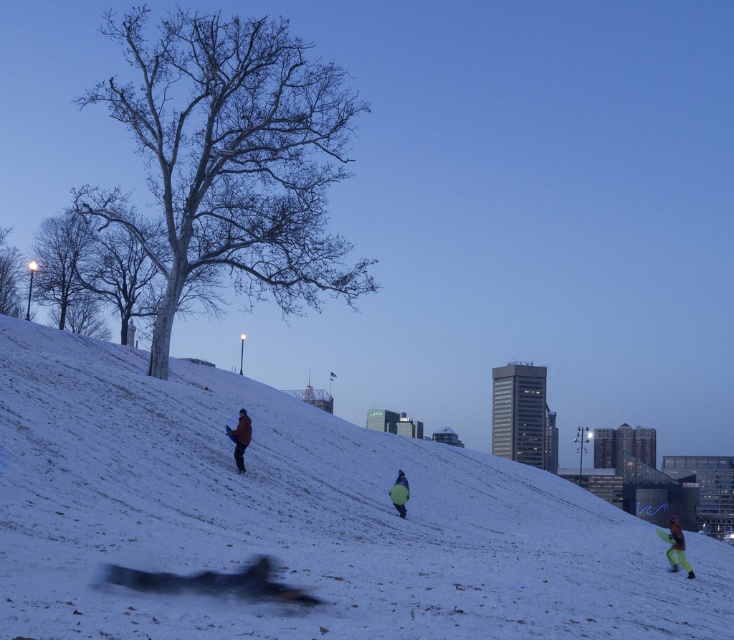
Is white snow at center below bare wood tree at left?

Indeed, white snow at center is positioned under bare wood tree at left.

Measure the distance between white snow at center and camera.

white snow at center and camera are 29.70 feet apart from each other.

Find the location of a particular element. This screenshot has height=640, width=734. white snow at center is located at coordinates (299, 516).

Does smooth gray tree at upper left have a larger size compared to dark blue snowsuit at center?

Indeed, smooth gray tree at upper left has a larger size compared to dark blue snowsuit at center.

At what (x,y) coordinates should I click in order to perform the action: click on smooth gray tree at upper left. Please return your answer as a coordinate pair (x, y). The width and height of the screenshot is (734, 640). Looking at the image, I should click on (65, 273).

Based on the photo, does smooth white tree at upper left have a smaller size compared to dark blue snowsuit at center?

No.

Can you confirm if smooth white tree at upper left is shorter than dark blue snowsuit at center?

No.

Image resolution: width=734 pixels, height=640 pixels. I want to click on smooth white tree at upper left, so click(x=10, y=276).